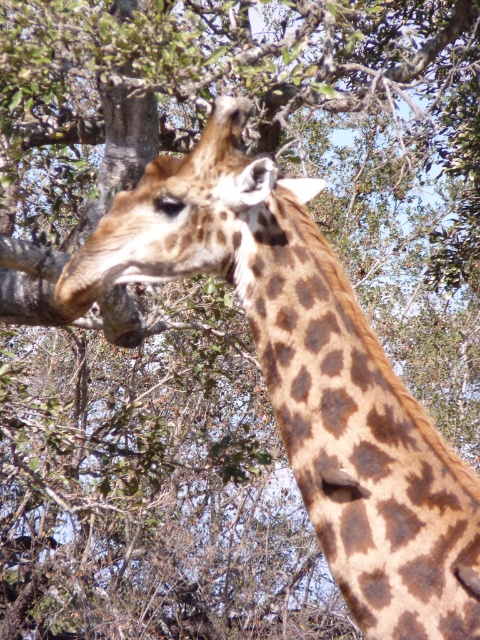
Between spotted fur neck at center and spotted fur at center, which one has more height?

spotted fur neck at center

Can you confirm if spotted fur neck at center is taller than spotted fur at center?

Yes.

Between point (243, 301) and point (222, 225), which one is positioned behind?

Point (243, 301)

Identify the location of spotted fur neck at center. (358, 438).